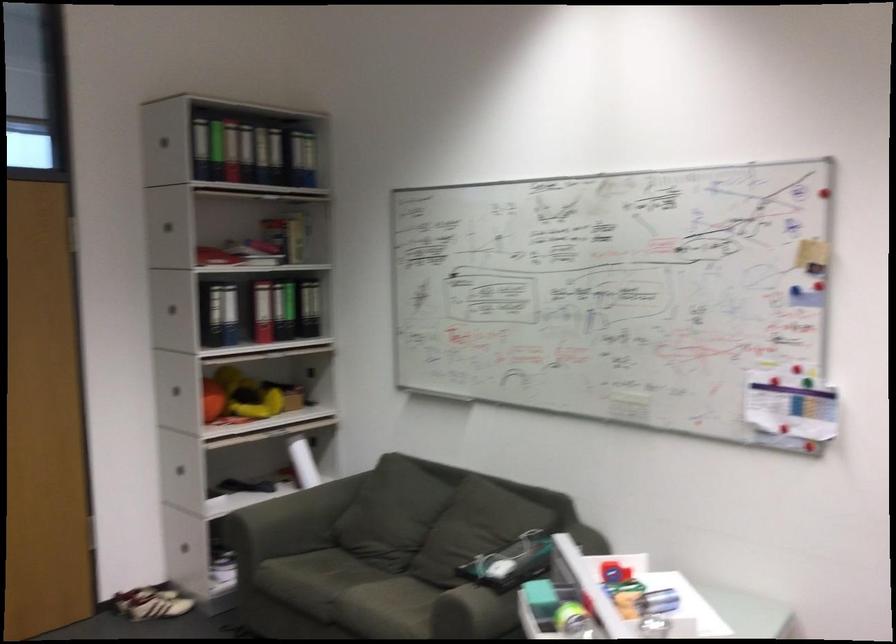
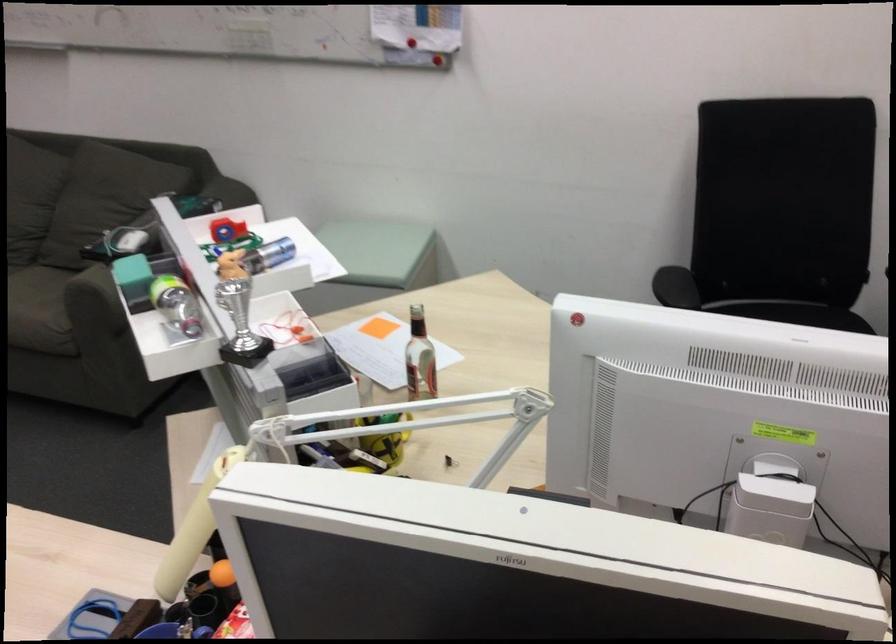
In the second image, find the point that corresponds to [580,567] in the first image.

(221, 230)